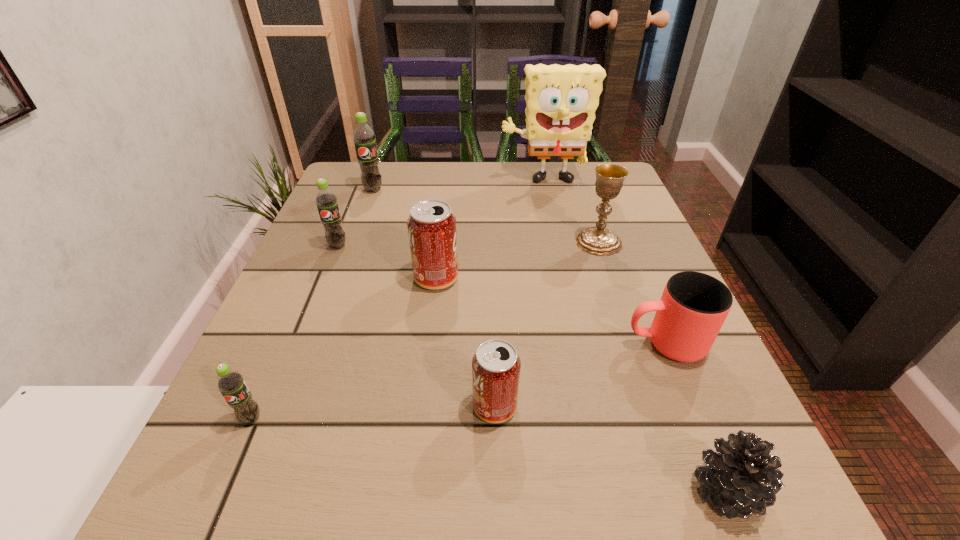
Locate an element on the screen. sponge that is at the right edge is located at coordinates (561, 101).

Identify the location of chalice positioned at the right edge. (598, 240).

Locate an element on the screen. Image resolution: width=960 pixels, height=540 pixels. cup that is positioned at the right edge is located at coordinates (693, 307).

At what (x,y) coordinates should I click in order to perform the action: click on pinecone at the right edge. Please return your answer as a coordinate pair (x, y). The width and height of the screenshot is (960, 540). Looking at the image, I should click on (743, 478).

Locate an element on the screen. Image resolution: width=960 pixels, height=540 pixels. object that is at the far left corner is located at coordinates (363, 136).

At what (x,y) coordinates should I click in order to perform the action: click on object that is at the far right corner. Please return your answer as a coordinate pair (x, y). This screenshot has width=960, height=540. Looking at the image, I should click on (561, 101).

Where is `object that is at the near right corner`? This screenshot has height=540, width=960. object that is at the near right corner is located at coordinates (743, 478).

You are a GUI agent. You are given a task and a screenshot of the screen. Output one action in this format:
    pyautogui.click(x=<x>, y=<y>)
    Task: Click on the free space at the far edge of the desktop
    The height and width of the screenshot is (540, 960).
    Given the screenshot: What is the action you would take?
    pyautogui.click(x=461, y=191)

Locate an element on the screen. This screenshot has height=540, width=960. vacant space at the near edge is located at coordinates (529, 477).

In the image, there is a desktop. Identify the location of vacant space at the left edge. This screenshot has width=960, height=540. (303, 274).